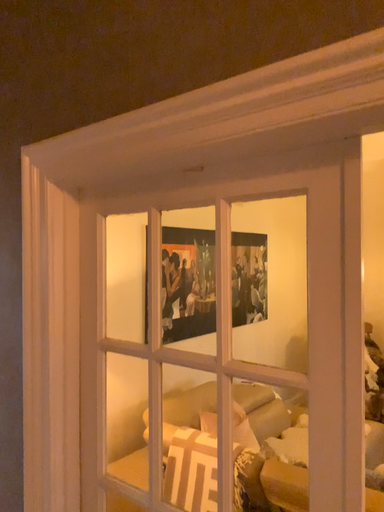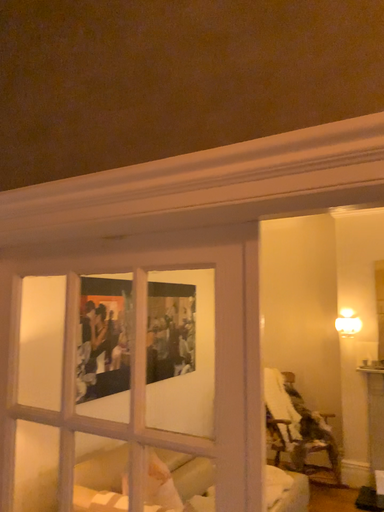
Question: How did the camera likely rotate when shooting the video?

Choices:
 (A) rotated downward
 (B) rotated upward

Answer: (B)